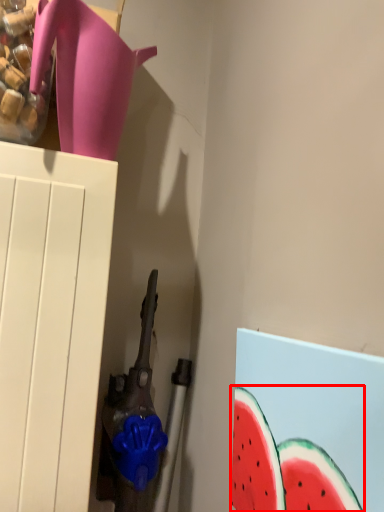
Question: Where is watermelon (annotated by the red box) located in relation to jug in the image?

Choices:
 (A) left
 (B) right

Answer: (B)